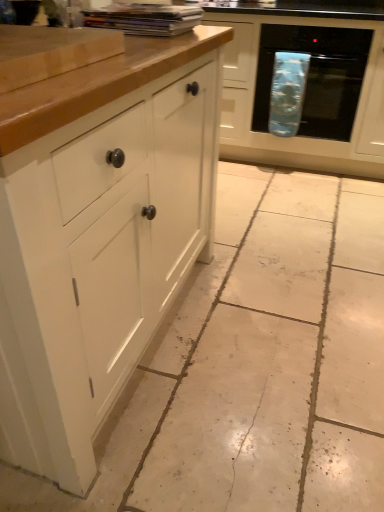
Measure the distance between blue fabric oven at right and camera.

They are 2.21 meters apart.

This screenshot has height=512, width=384. I want to click on matte white cabinet at center, the 1th cabinetry positioned from the right, so point(306,85).

Where is `white tile floor at center`? white tile floor at center is located at coordinates (281, 362).

This screenshot has height=512, width=384. I want to click on cabinetry on the right of white tile floor at center, so click(x=306, y=85).

Does matte white cabinet at center, marked as the second cabinetry in a front-to-back arrangement, contain white tile floor at center?

No, white tile floor at center is not a part of matte white cabinet at center, marked as the second cabinetry in a front-to-back arrangement.

From the image's perspective, which one is positioned lower, matte white cabinet at center, marked as the second cabinetry in a front-to-back arrangement, or white tile floor at center?

white tile floor at center is shown below in the image.

From a real-world perspective, is blue fabric oven at right below white tile floor at center?

Incorrect, from a real-world perspective, blue fabric oven at right is higher than white tile floor at center.

Does blue fabric oven at right appear on the right side of white tile floor at center?

Indeed, blue fabric oven at right is positioned on the right side of white tile floor at center.

Between point (329, 58) and point (292, 253), which one is positioned behind?

The point (329, 58) is more distant.

From the image's perspective, between blue fabric oven at right and white tile floor at center, which one is located above?

blue fabric oven at right is shown above in the image.

Considering their positions, is white matte cabinet at left, acting as the 2th cabinetry starting from the back, located in front of or behind matte white cabinet at center, marked as the second cabinetry in a front-to-back arrangement?

In the image, white matte cabinet at left, acting as the 2th cabinetry starting from the back, appears in front of matte white cabinet at center, marked as the second cabinetry in a front-to-back arrangement.

Considering the sizes of objects white matte cabinet at left, the 1th cabinetry viewed from the front, and matte white cabinet at center, marked as the second cabinetry in a front-to-back arrangement, in the image provided, who is bigger, white matte cabinet at left, the 1th cabinetry viewed from the front, or matte white cabinet at center, marked as the second cabinetry in a front-to-back arrangement,?

white matte cabinet at left, the 1th cabinetry viewed from the front, is bigger.

Is point (184, 49) closer to viewer compared to point (380, 160)?

Yes.

From a real-world perspective, which object stands above the other?

matte white cabinet at center, marked as the second cabinetry in a front-to-back arrangement, from a real-world perspective.

Which is more to the right, matte white cabinet at center, the 1th cabinetry positioned from the right, or white matte cabinet at left, marked as the 1th cabinetry in a left-to-right arrangement?

matte white cabinet at center, the 1th cabinetry positioned from the right, is more to the right.

At what (x,y) coordinates should I click in order to perform the action: click on cabinetry that is in front of the matte white cabinet at center, marked as the second cabinetry in a front-to-back arrangement. Please return your answer as a coordinate pair (x, y). Looking at the image, I should click on (98, 234).

Is matte white cabinet at center, the 1th cabinetry positioned from the right, facing towards white matte cabinet at left, acting as the 2th cabinetry starting from the back?

Yes, matte white cabinet at center, the 1th cabinetry positioned from the right, is aimed at white matte cabinet at left, acting as the 2th cabinetry starting from the back.

Considering the sizes of matte white cabinet at center, the 1th cabinetry from the back, and white matte cabinet at left, acting as the 2th cabinetry starting from the back, in the image, is matte white cabinet at center, the 1th cabinetry from the back, wider or thinner than white matte cabinet at left, acting as the 2th cabinetry starting from the back,?

Clearly, matte white cabinet at center, the 1th cabinetry from the back, has less width compared to white matte cabinet at left, acting as the 2th cabinetry starting from the back.

In the image, is matte white cabinet at center, the second cabinetry viewed from the left, positioned in front of or behind blue fabric oven at right?

matte white cabinet at center, the second cabinetry viewed from the left, is in front of blue fabric oven at right.

From a real-world perspective, which object rests below the other?

matte white cabinet at center, marked as the second cabinetry in a front-to-back arrangement, from a real-world perspective.

Considering the relative sizes of matte white cabinet at center, the 1th cabinetry positioned from the right, and blue fabric oven at right in the image provided, is matte white cabinet at center, the 1th cabinetry positioned from the right, thinner than blue fabric oven at right?

Yes, matte white cabinet at center, the 1th cabinetry positioned from the right, is thinner than blue fabric oven at right.

In terms of size, does matte white cabinet at center, the 1th cabinetry from the back, appear bigger or smaller than blue fabric oven at right?

Clearly, matte white cabinet at center, the 1th cabinetry from the back, is larger in size than blue fabric oven at right.

Considering the relative positions of white tile floor at center and blue fabric oven at right in the image provided, is white tile floor at center to the right of blue fabric oven at right from the viewer's perspective?

Incorrect, white tile floor at center is not on the right side of blue fabric oven at right.

From the picture: Is white tile floor at center facing towards blue fabric oven at right?

No, white tile floor at center is not aimed at blue fabric oven at right.

Who is taller, white tile floor at center or blue fabric oven at right?

With more height is blue fabric oven at right.

Based on the photo, is white matte cabinet at left, the second cabinetry viewed from the right, inside or outside of white tile floor at center?

The correct answer is: outside.

Can you tell me how much white matte cabinet at left, acting as the 2th cabinetry starting from the back, and white tile floor at center differ in facing direction?

0.593 degrees.

From the image's perspective, relative to white tile floor at center, is white matte cabinet at left, acting as the 2th cabinetry starting from the back, above or below?

white matte cabinet at left, acting as the 2th cabinetry starting from the back, is situated higher than white tile floor at center in the image.

Considering the relative sizes of white matte cabinet at left, acting as the 2th cabinetry starting from the back, and white tile floor at center in the image provided, is white matte cabinet at left, acting as the 2th cabinetry starting from the back, bigger than white tile floor at center?

Yes.

Find the location of a particular element. The width and height of the screenshot is (384, 512). concrete that is below the matte white cabinet at center, the 1th cabinetry positioned from the right (from the image's perspective) is located at coordinates (281, 362).

Find the location of a particular element. This screenshot has width=384, height=512. concrete below the blue fabric oven at right (from a real-world perspective) is located at coordinates (281, 362).

From the image, which object appears to be farther from white tile floor at center, matte white cabinet at center, the 1th cabinetry positioned from the right, or white matte cabinet at left, acting as the 2th cabinetry starting from the back?

matte white cabinet at center, the 1th cabinetry positioned from the right.

When comparing their distances from matte white cabinet at center, the second cabinetry viewed from the left, does white tile floor at center or white matte cabinet at left, the second cabinetry viewed from the right, seem further?

white matte cabinet at left, the second cabinetry viewed from the right, is further to matte white cabinet at center, the second cabinetry viewed from the left.

From the image, which object appears to be farther from white matte cabinet at left, the 1th cabinetry viewed from the front, white tile floor at center or blue fabric oven at right?

blue fabric oven at right is positioned further to the anchor white matte cabinet at left, the 1th cabinetry viewed from the front.

Which object lies further to the anchor point white tile floor at center, white matte cabinet at left, the 1th cabinetry viewed from the front, or matte white cabinet at center, the second cabinetry viewed from the left?

Based on the image, matte white cabinet at center, the second cabinetry viewed from the left, appears to be further to white tile floor at center.

Based on their spatial positions, is matte white cabinet at center, the 1th cabinetry positioned from the right, or blue fabric oven at right further from white tile floor at center?

blue fabric oven at right is positioned further to the anchor white tile floor at center.

Based on their spatial positions, is white tile floor at center or matte white cabinet at center, the 1th cabinetry from the back, further from blue fabric oven at right?

white tile floor at center is positioned further to the anchor blue fabric oven at right.

Estimate the real-world distances between objects in this image. Which object is further from white matte cabinet at left, the second cabinetry viewed from the right, blue fabric oven at right or matte white cabinet at center, the 1th cabinetry positioned from the right?

Among the two, blue fabric oven at right is located further to white matte cabinet at left, the second cabinetry viewed from the right.

Considering their positions, is white tile floor at center positioned closer to blue fabric oven at right than white matte cabinet at left, the second cabinetry viewed from the right?

The object closer to blue fabric oven at right is white tile floor at center.

The width and height of the screenshot is (384, 512). Identify the location of concrete between white matte cabinet at left, the second cabinetry viewed from the right, and blue fabric oven at right from front to back. (281, 362).

I want to click on cabinetry positioned between white tile floor at center and blue fabric oven at right from near to far, so click(x=306, y=85).

Locate an element on the screen. The image size is (384, 512). cabinetry between white matte cabinet at left, the 1th cabinetry viewed from the front, and blue fabric oven at right from front to back is located at coordinates point(306,85).

This screenshot has height=512, width=384. I want to click on concrete between white matte cabinet at left, the 1th cabinetry viewed from the front, and matte white cabinet at center, the 1th cabinetry from the back, along the z-axis, so click(x=281, y=362).